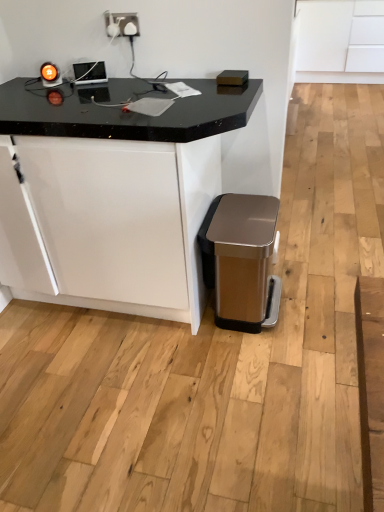
The height and width of the screenshot is (512, 384). Find the location of `satin gold plastic trash can at lower right`. satin gold plastic trash can at lower right is located at coordinates (242, 260).

Where is `satin white socket at upper center`? satin white socket at upper center is located at coordinates (122, 24).

Locate an element on the screen. This screenshot has height=512, width=384. black marble table at center is located at coordinates (115, 194).

You are a GUI agent. You are given a task and a screenshot of the screen. Output one action in this format:
    pyautogui.click(x=<x>, y=<y>)
    Task: Click on the satin gold plastic trash can at lower right
    The height and width of the screenshot is (512, 384).
    Given the screenshot: What is the action you would take?
    pyautogui.click(x=242, y=260)

Looking at this image, is satin gold plastic trash can at lower right aimed at white matte cabinet at upper right?

No.

Is point (234, 257) more distant than point (344, 8)?

No, it is not.

The width and height of the screenshot is (384, 512). I want to click on cabinetry that is above the satin gold plastic trash can at lower right (from the image's perspective), so click(x=340, y=41).

Is satin gold plastic trash can at lower right taller than white matte cabinet at upper right?

No, satin gold plastic trash can at lower right is not taller than white matte cabinet at upper right.

Is black marble table at center at the left side of satin gold plastic trash can at lower right?

Indeed, black marble table at center is positioned on the left side of satin gold plastic trash can at lower right.

Does black marble table at center have a lesser width compared to satin gold plastic trash can at lower right?

In fact, black marble table at center might be wider than satin gold plastic trash can at lower right.

Is black marble table at center further to the viewer compared to satin gold plastic trash can at lower right?

No, it is not.

Is black marble table at center taller or shorter than satin gold plastic trash can at lower right?

In the image, black marble table at center appears to be taller than satin gold plastic trash can at lower right.

Is there a large distance between satin gold plastic trash can at lower right and satin white socket at upper center?

satin gold plastic trash can at lower right is positioned a significant distance from satin white socket at upper center.

Looking at this image, measure the distance from satin gold plastic trash can at lower right to satin white socket at upper center.

satin gold plastic trash can at lower right and satin white socket at upper center are 3.38 feet apart from each other.

Is point (235, 228) farther from camera compared to point (137, 35)?

Yes.

Which is correct: white matte cabinet at upper right is inside satin white socket at upper center, or outside of it?

white matte cabinet at upper right is not inside satin white socket at upper center, it's outside.

Is white matte cabinet at upper right wider than satin white socket at upper center?

Correct, the width of white matte cabinet at upper right exceeds that of satin white socket at upper center.

From the image's perspective, is white matte cabinet at upper right located beneath satin white socket at upper center?

No, from the image's perspective, white matte cabinet at upper right is not beneath satin white socket at upper center.

Would you consider white matte cabinet at upper right to be distant from satin white socket at upper center?

Indeed, white matte cabinet at upper right is not near satin white socket at upper center.

Is white matte cabinet at upper right inside satin white socket at upper center?

Definitely not — white matte cabinet at upper right is not inside satin white socket at upper center.

Could you tell me if satin white socket at upper center is facing white matte cabinet at upper right?

No, satin white socket at upper center is not facing towards white matte cabinet at upper right.

Is satin white socket at upper center touching white matte cabinet at upper right?

No, satin white socket at upper center is not beside white matte cabinet at upper right.

Which object is wider, white matte cabinet at upper right or satin gold plastic trash can at lower right?

With larger width is white matte cabinet at upper right.

This screenshot has height=512, width=384. Find the location of `waste container beneath the white matte cabinet at upper right (from a real-world perspective)`. waste container beneath the white matte cabinet at upper right (from a real-world perspective) is located at coordinates (242, 260).

Which of these two, white matte cabinet at upper right or satin gold plastic trash can at lower right, stands shorter?

satin gold plastic trash can at lower right is shorter.

Does satin white socket at upper center turn towards black marble table at center?

No, satin white socket at upper center does not turn towards black marble table at center.

Is satin white socket at upper center positioned beyond the bounds of black marble table at center?

satin white socket at upper center lies outside black marble table at center's area.

In the scene shown: Between satin white socket at upper center and black marble table at center, which one has smaller size?

With smaller size is satin white socket at upper center.

I want to click on cabinetry behind the satin gold plastic trash can at lower right, so click(x=340, y=41).

Locate an element on the screen. This screenshot has height=512, width=384. table in front of the satin gold plastic trash can at lower right is located at coordinates (115, 194).

Based on their spatial positions, is satin white socket at upper center or white matte cabinet at upper right closer to satin gold plastic trash can at lower right?

Based on the image, satin white socket at upper center appears to be nearer to satin gold plastic trash can at lower right.

Looking at the image, which one is located further to white matte cabinet at upper right, satin white socket at upper center or black marble table at center?

Among the two, black marble table at center is located further to white matte cabinet at upper right.

When comparing their distances from black marble table at center, does white matte cabinet at upper right or satin white socket at upper center seem closer?

satin white socket at upper center.

Based on their spatial positions, is black marble table at center or satin gold plastic trash can at lower right closer to satin white socket at upper center?

Among the two, black marble table at center is located nearer to satin white socket at upper center.

When comparing their distances from black marble table at center, does satin white socket at upper center or satin gold plastic trash can at lower right seem further?

satin white socket at upper center is further to black marble table at center.

Estimate the real-world distances between objects in this image. Which object is closer to white matte cabinet at upper right, satin gold plastic trash can at lower right or satin white socket at upper center?

satin gold plastic trash can at lower right.

Based on their spatial positions, is satin gold plastic trash can at lower right or white matte cabinet at upper right closer to satin white socket at upper center?

satin gold plastic trash can at lower right.

Which object lies further to the anchor point white matte cabinet at upper right, satin gold plastic trash can at lower right or black marble table at center?

Based on the image, black marble table at center appears to be further to white matte cabinet at upper right.

Image resolution: width=384 pixels, height=512 pixels. I want to click on electric outlet between satin gold plastic trash can at lower right and white matte cabinet at upper right in the front-back direction, so click(x=122, y=24).

This screenshot has width=384, height=512. What are the coordinates of `waste container between black marble table at center and white matte cabinet at upper right along the z-axis` in the screenshot? It's located at (242, 260).

Where is `electric outlet between black marble table at center and white matte cabinet at upper right in the front-back direction`? The height and width of the screenshot is (512, 384). electric outlet between black marble table at center and white matte cabinet at upper right in the front-back direction is located at coordinates (122, 24).

Locate an element on the screen. The height and width of the screenshot is (512, 384). table that lies between satin white socket at upper center and satin gold plastic trash can at lower right from top to bottom is located at coordinates (115, 194).